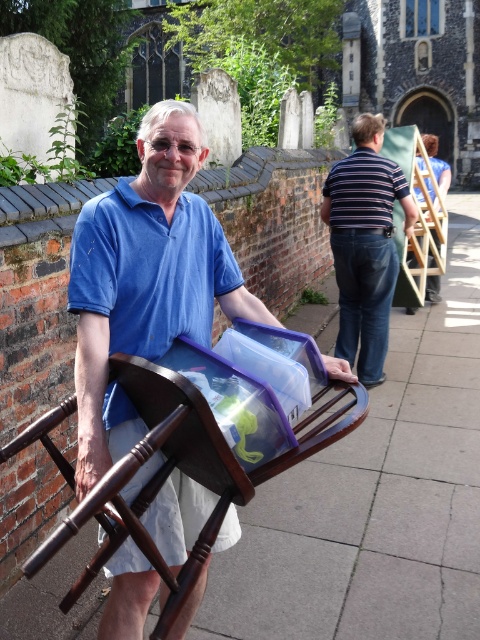
You are a fashion designer observing the man in the image. He is wearing two shirts, the matte blue shirt at center and the striped cotton shirt at center. Which shirt is visible on top?

The striped cotton shirt at center is visible on top because the matte blue shirt at center is below it.

You are standing in front of a man holding a chair with a plastic container on top. He is wearing a matte blue shirt at center. If you want to hand him a document without moving closer, can you reach him from your current position?

The matte blue shirt at center and viewer are 1.56 meters apart. Since the distance is 1.56 meters, you can likely reach him without moving closer, as this distance is within typical reaching range for handing an object.

You are a photographer standing 2 meters away from the man in the scene. You want to capture both the matte blue shirt at center and the striped cotton shirt at center in a single photo. Can you fit both shirts into the frame without moving your position? Explain your reasoning.

The matte blue shirt at center and striped cotton shirt at center are 3.11 meters apart from each other. Since you are standing 2 meters away from the man, the distance between the shirts may be too wide to capture both in a single frame without moving. The separation between them exceeds the typical field of view at that distance, so you might need to adjust your position or use a wider lens.